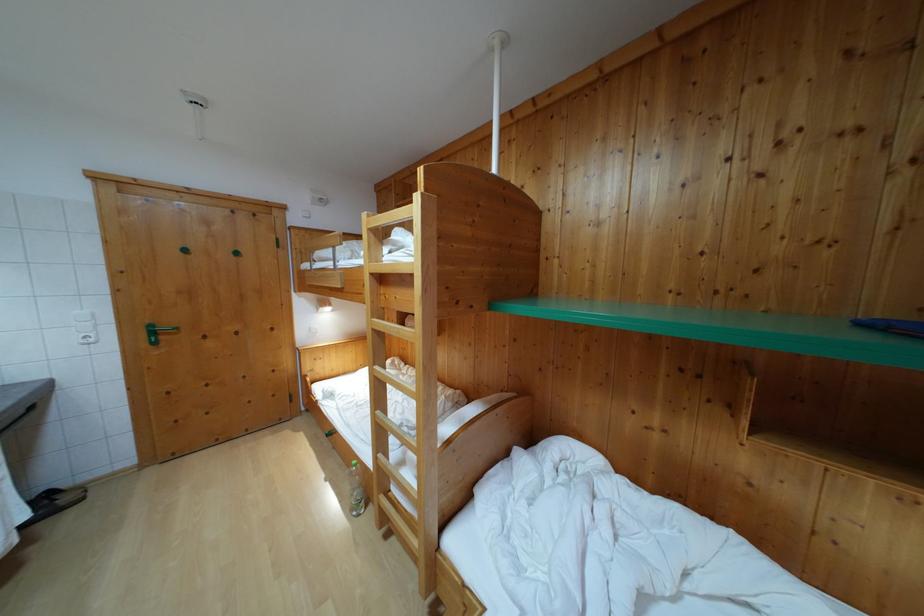
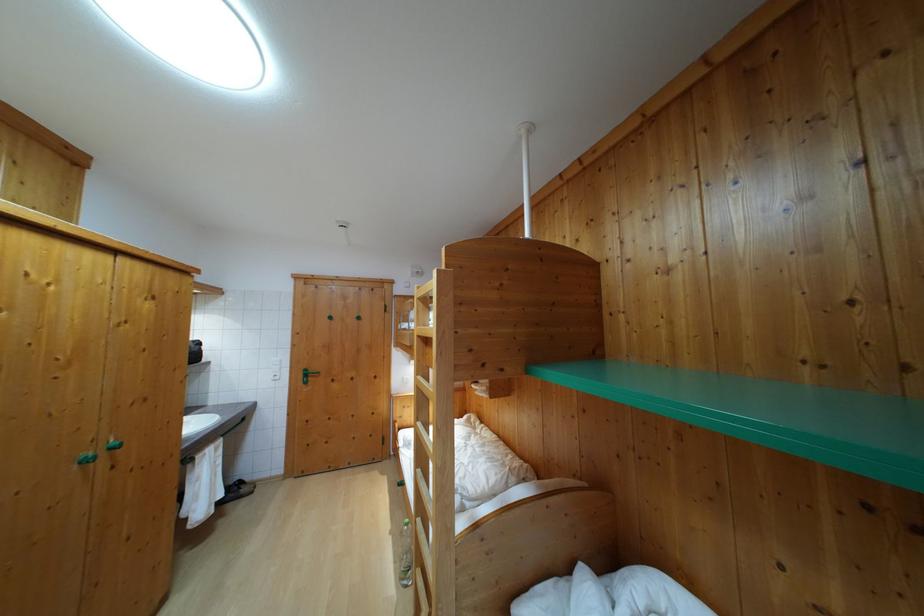
Question: Based on the continuous images, in which direction is the camera rotating? Reply with the corresponding letter.

Choices:
 (A) Left
 (B) Right
 (C) Up
 (D) Down

Answer: (A)